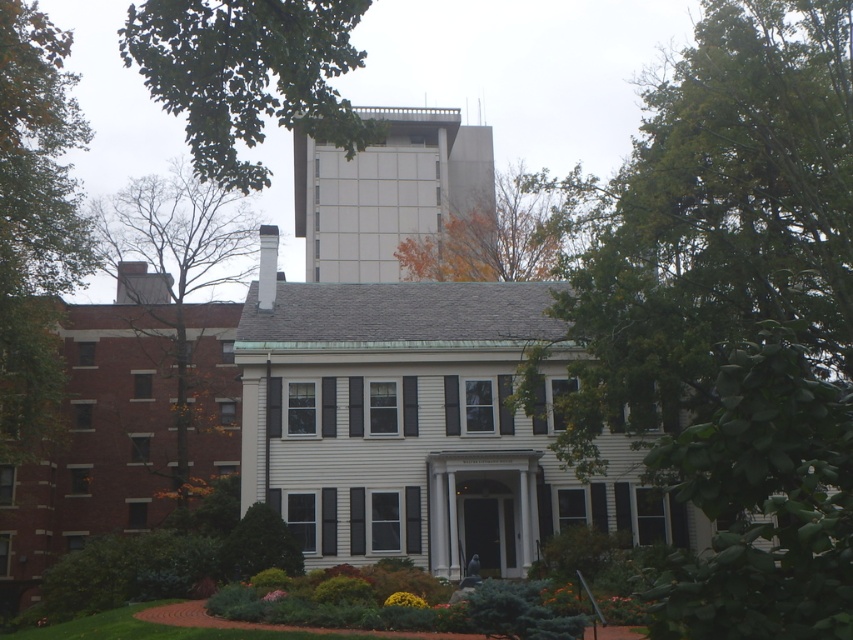
You are standing in front of the house and want to take a photo of the green leafy tree at upper center. Where should you position yourself to capture it in the center of your camera frame?

You should position yourself directly in front of the house, slightly to the left since the green leafy tree at upper center is located at point coordinates 0.117 on the horizontal axis and 0.292 on the vertical axis, which places it towards the upper left quadrant of the image.

You are standing in front of the house and want to determine the relative positions of two points in the garden. The first point is at coordinates point (834,372) and the second is at point (444,253). Which point is closer to you?

Point (834,372) is closer to the viewer than point (444,253).